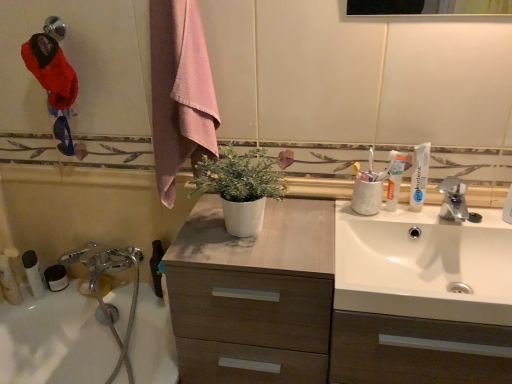
This screenshot has width=512, height=384. I want to click on vacant space that is in between white matte pot at center and white matte toothpaste at upper right, the second toothpaste viewed from the right, so click(320, 226).